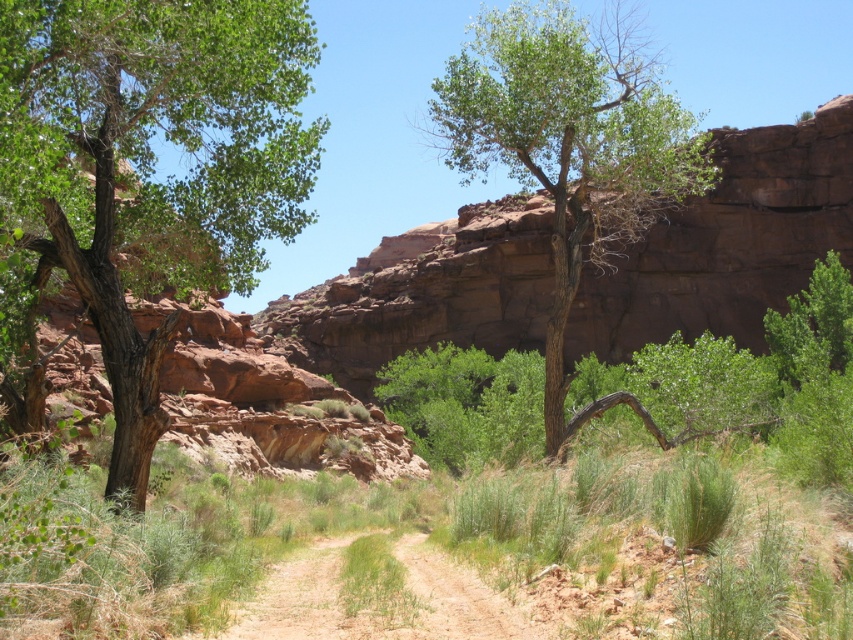
Who is shorter, green leafy tree at center or brown sandy dirt track at center?

With less height is brown sandy dirt track at center.

Is the position of green leafy tree at center less distant than that of brown sandy dirt track at center?

That is False.

In order to click on green leafy tree at center in this screenshot , I will do `click(572, 150)`.

Image resolution: width=853 pixels, height=640 pixels. I want to click on green leafy tree at center, so click(x=572, y=150).

Which is behind, point (218, 276) or point (518, 612)?

Point (218, 276)

Can you confirm if green leafy tree at left is positioned below brown sandy dirt track at center?

No, green leafy tree at left is not below brown sandy dirt track at center.

Is point (22, 209) behind point (270, 577)?

No.

Find the location of a particular element. The image size is (853, 640). green leafy tree at left is located at coordinates (152, 164).

Does green leafy tree at left appear under green leafy tree at center?

Yes.

Between point (231, 88) and point (614, 243), which one is positioned in front?

Point (231, 88)

Locate an element on the screen. Image resolution: width=853 pixels, height=640 pixels. green leafy tree at left is located at coordinates (152, 164).